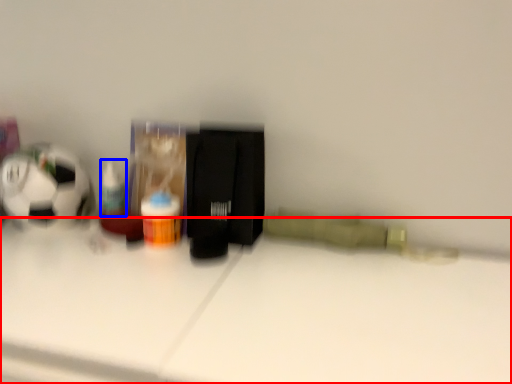
Question: Among these objects, which one is farthest to the camera, table (highlighted by a red box) or toiletry (highlighted by a blue box)?

Choices:
 (A) table
 (B) toiletry

Answer: (B)